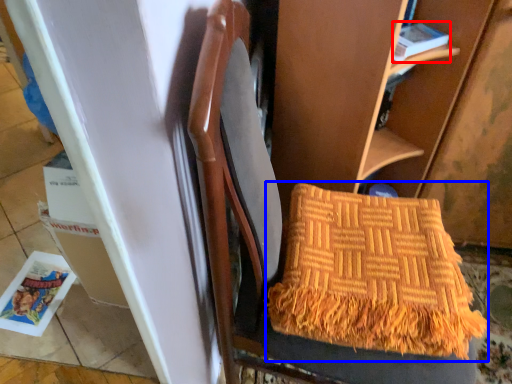
Question: Which point is closer to the camera, magazine (highlighted by a red box) or blanket (highlighted by a blue box)?

Choices:
 (A) magazine
 (B) blanket

Answer: (B)